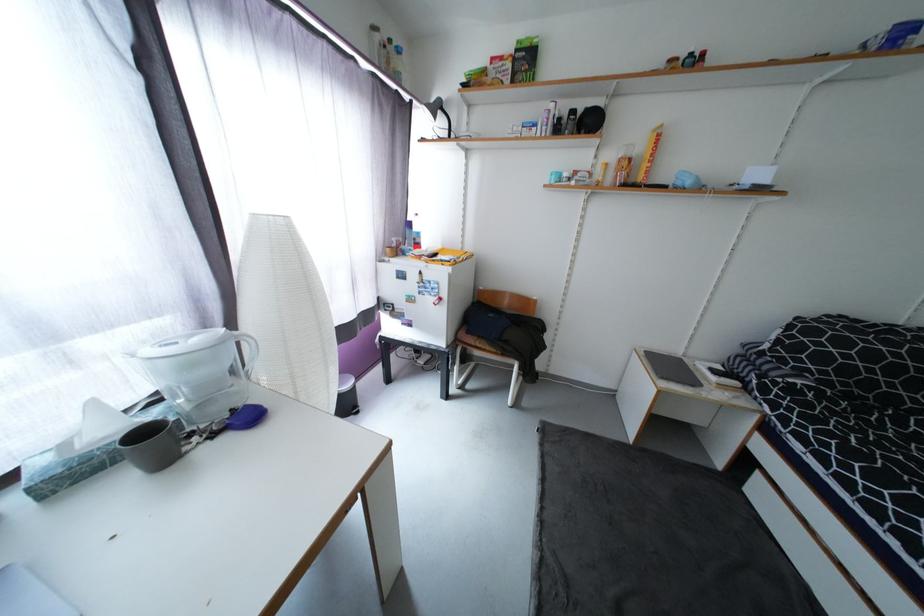
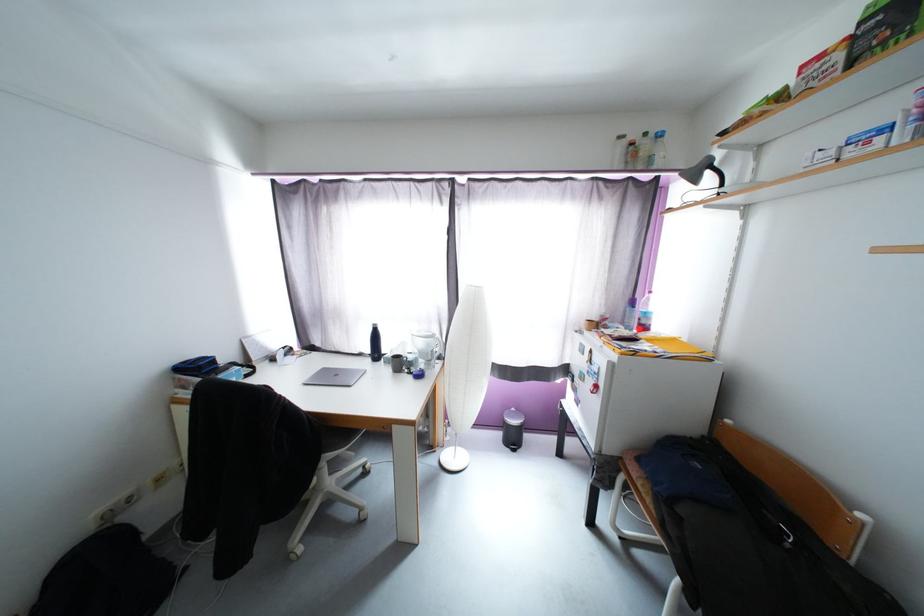
Question: The camera is either moving clockwise (left) or counter-clockwise (right) around the object. The first image is from the beginning of the video and the second image is from the end. Is the camera moving left or right when shooting the video?

Choices:
 (A) Left
 (B) Right

Answer: (B)